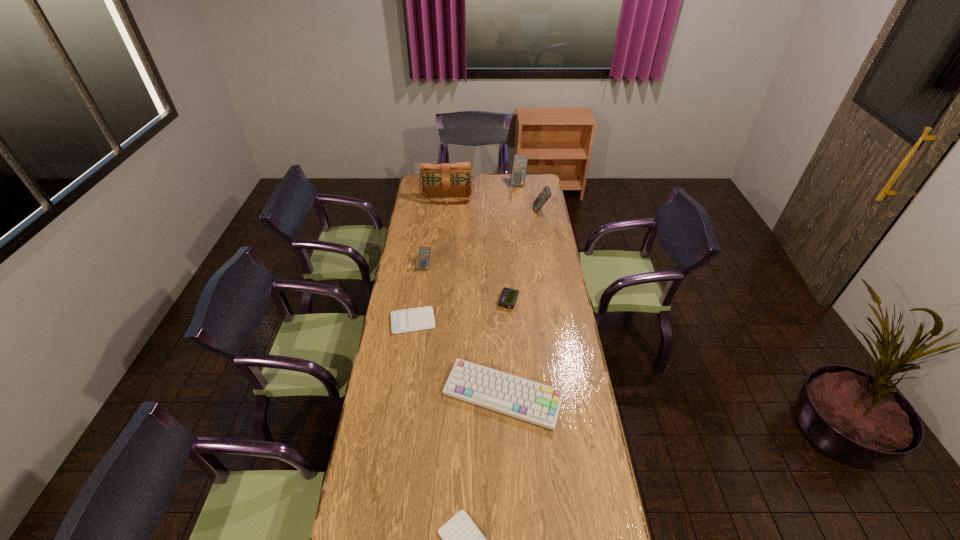
In order to click on free space located 0.330m on the left of the beeper in this screenshot , I will do `click(428, 301)`.

In order to click on vacant space located on the front of the second shortest object in this screenshot , I will do `click(405, 372)`.

Locate an element on the screen. The width and height of the screenshot is (960, 540). shoulder bag that is at the far edge is located at coordinates (438, 180).

Locate an element on the screen. The height and width of the screenshot is (540, 960). calculator located at the far edge is located at coordinates (519, 165).

I want to click on shoulder bag positioned at the left edge, so click(x=438, y=180).

I want to click on computer keyboard located in the right edge section of the desktop, so click(514, 396).

At what (x,y) coordinates should I click in order to perform the action: click on object situated at the far left corner. Please return your answer as a coordinate pair (x, y). The height and width of the screenshot is (540, 960). Looking at the image, I should click on (438, 180).

Where is `object present at the far right corner`? The width and height of the screenshot is (960, 540). object present at the far right corner is located at coordinates (519, 165).

The width and height of the screenshot is (960, 540). In the image, there is a desktop. Find the location of `vacant region at the left edge`. vacant region at the left edge is located at coordinates (388, 495).

In the image, there is a desktop. At what (x,y) coordinates should I click in order to perform the action: click on free region at the right edge. Please return your answer as a coordinate pair (x, y). Looking at the image, I should click on (531, 270).